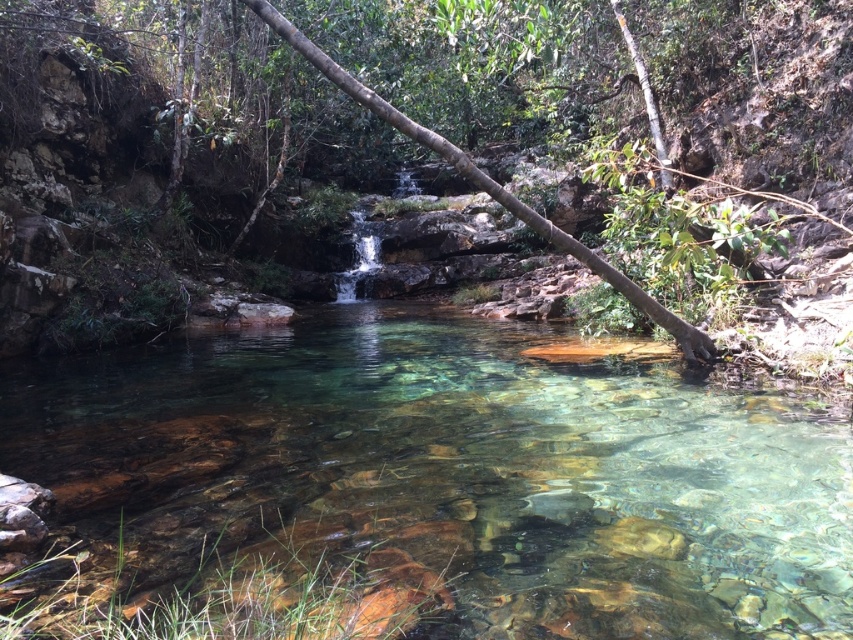
Question: Can you confirm if clear glassy stream at center is wider than brown wood tree at center?

Choices:
 (A) no
 (B) yes

Answer: (A)

Question: Where is clear glassy stream at center located in relation to brown wood tree at center in the image?

Choices:
 (A) below
 (B) above

Answer: (A)

Question: Which object is farther from the camera taking this photo?

Choices:
 (A) clear glassy stream at center
 (B) brown wood tree at center

Answer: (B)

Question: Does clear glassy stream at center appear under brown wood tree at center?

Choices:
 (A) no
 (B) yes

Answer: (B)